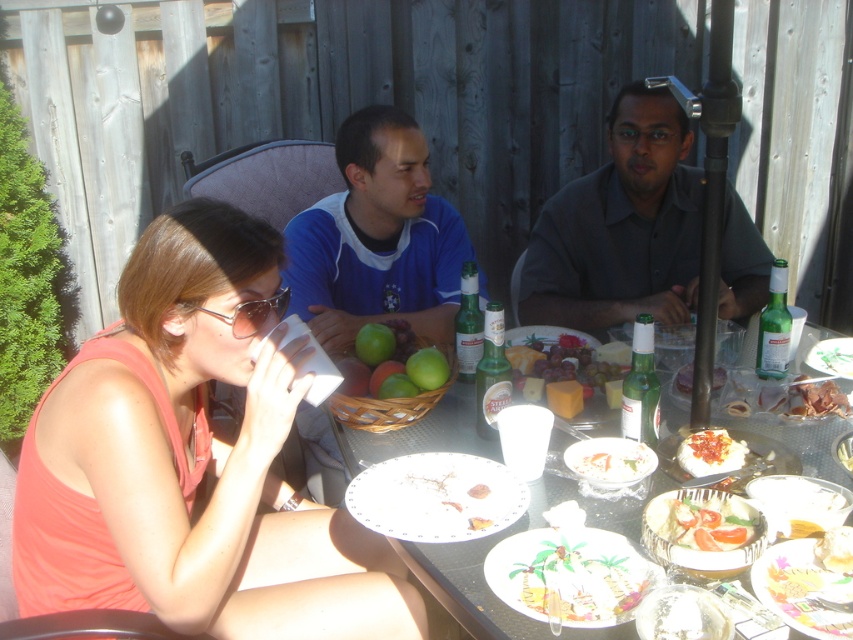
Which is above, printed paper plate at lower center or tomato salad with dressing at center?

tomato salad with dressing at center is higher up.

Does printed paper plate at lower center have a greater width compared to tomato salad with dressing at center?

Correct, the width of printed paper plate at lower center exceeds that of tomato salad with dressing at center.

Where is `printed paper plate at lower center`? printed paper plate at lower center is located at coordinates (570, 573).

Is point (570, 218) farther from viewer compared to point (840, 547)?

Yes, it is.

Is dark gray shirt at center below smooth yellow cake at lower right?

No.

Who is more distant from viewer, [531,304] or [849,528]?

Point [531,304]

At what (x,y) coordinates should I click in order to perform the action: click on dark gray shirt at center. Please return your answer as a coordinate pair (x, y). Looking at the image, I should click on (621, 227).

Does green matte apples at center have a greater width compared to white creamy sauce at center?

Yes, green matte apples at center is wider than white creamy sauce at center.

Between point (375, 349) and point (686, 472), which one is positioned in front?

Point (686, 472) is in front.

Where is `green matte apples at center`? The width and height of the screenshot is (853, 640). green matte apples at center is located at coordinates (376, 355).